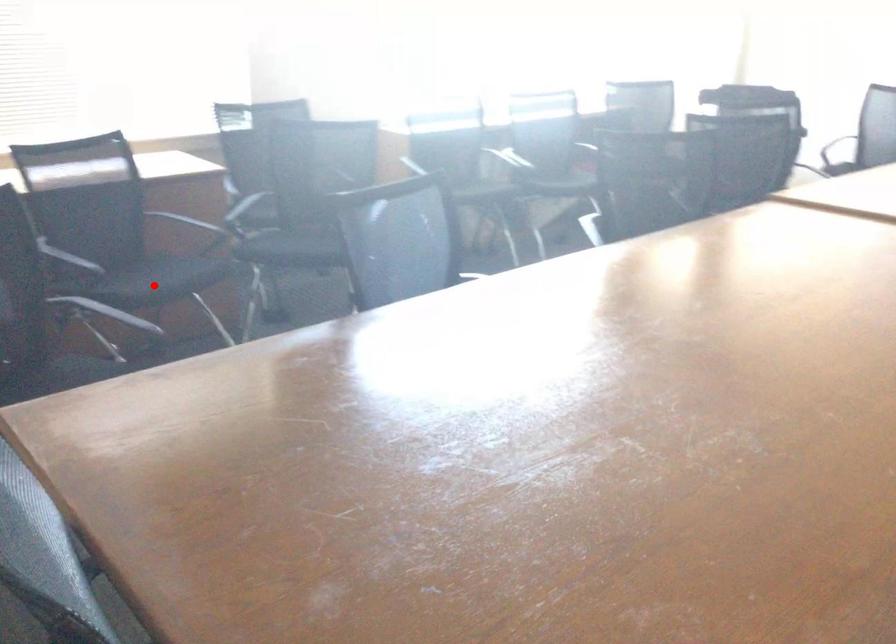
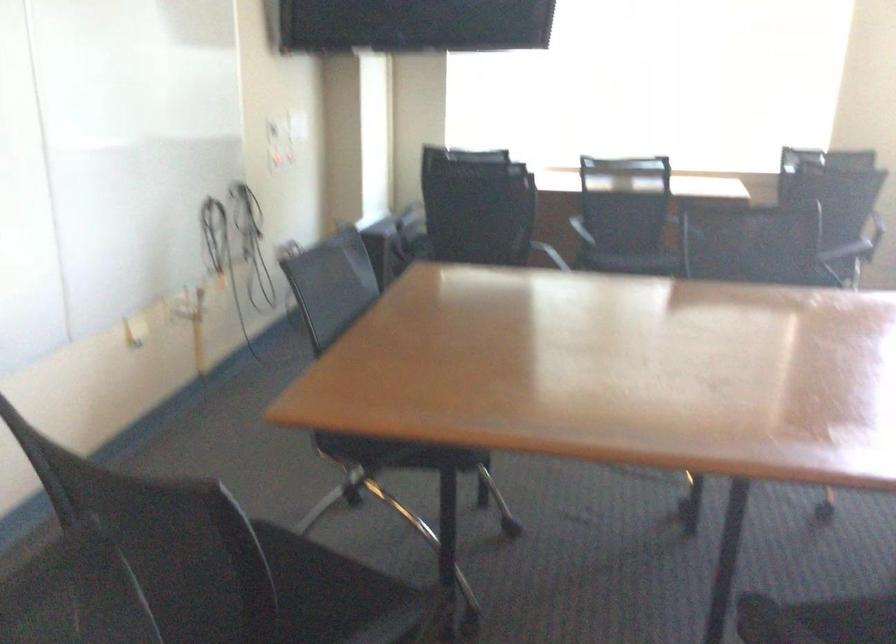
Locate, in the second image, the point that corresponds to the highlighted location in the first image.

(633, 260)